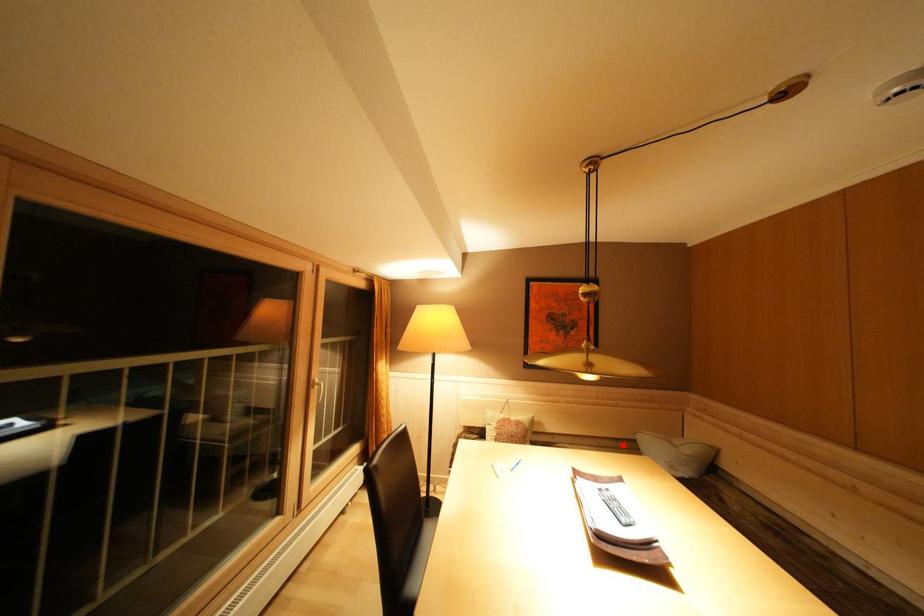
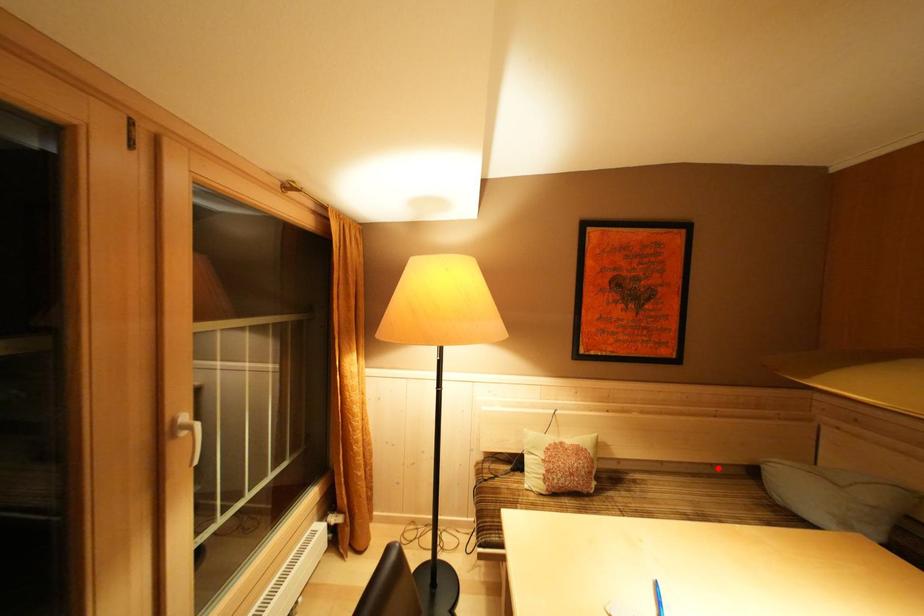
I am providing you with two images of the same scene from different viewpoints. A red point is marked on the first image and another point is marked on the second image. Is the marked point in image1 the same physical position as the marked point in image2?

Yes